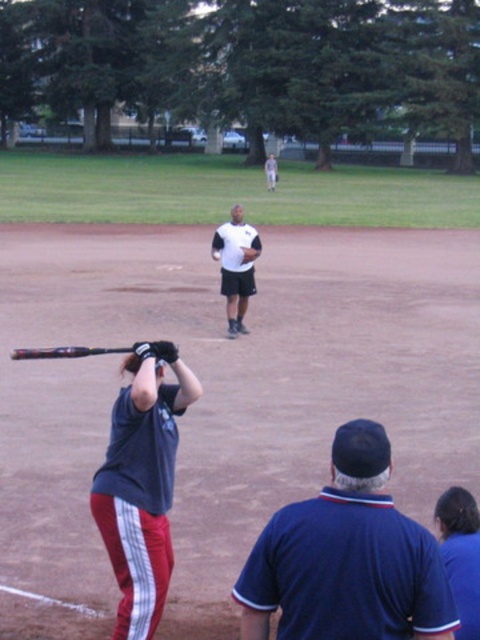
Does dark blue jersey at center appear on the left side of white matte jersey at center?

Indeed, dark blue jersey at center is positioned on the left side of white matte jersey at center.

Is dark blue jersey at center bigger than white matte jersey at center?

Actually, dark blue jersey at center might be smaller than white matte jersey at center.

This screenshot has width=480, height=640. I want to click on dark blue jersey at center, so click(142, 484).

Between blue jersey at center and white matte jersey at center, which one appears on the left side from the viewer's perspective?

white matte jersey at center

Can you confirm if blue jersey at center is wider than white matte jersey at center?

Yes.

In the scene shown: Who is more distant from viewer, (x=444, y=579) or (x=250, y=241)?

The point (x=250, y=241) is behind.

What are the coordinates of `blue jersey at center` in the screenshot? It's located at (347, 557).

Is blue jersey at center to the right of dark blue jersey at center from the viewer's perspective?

Indeed, blue jersey at center is positioned on the right side of dark blue jersey at center.

Locate an element on the screen. blue jersey at center is located at coordinates (347, 557).

Between point (391, 618) and point (120, 493), which one is positioned in front?

Point (391, 618)

You are a GUI agent. You are given a task and a screenshot of the screen. Output one action in this format:
    pyautogui.click(x=<x>, y=<y>)
    Task: Click on the blue jersey at center
    This screenshot has width=480, height=640.
    Given the screenshot: What is the action you would take?
    pyautogui.click(x=347, y=557)